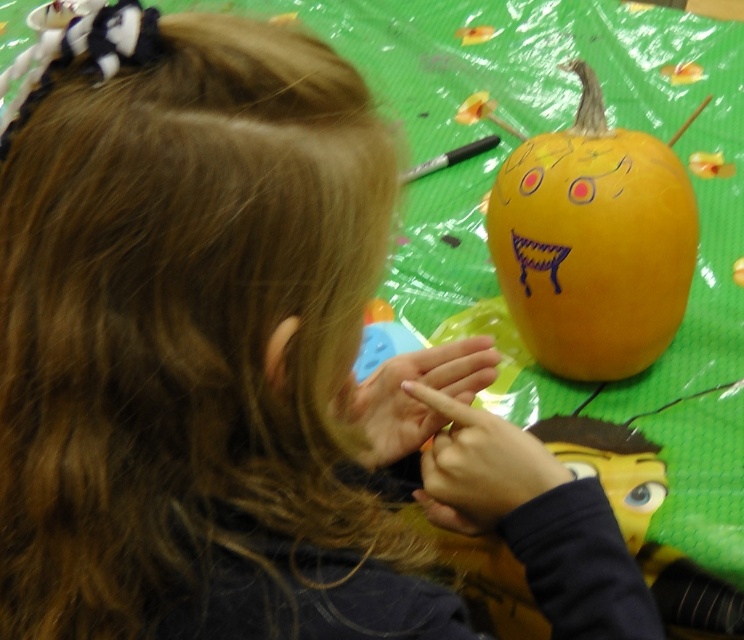
You are a parent helping your child decorate a pumpkin. You have a matte orange pumpkin at center and a smooth yellow face at center. Which object is bigger?

The matte orange pumpkin at center is larger in size than the smooth yellow face at center.

The matte orange pumpkin at center is placed on a green plastic tablecloth. If the pumpkin is 27.59 inches away from the edge of the tablecloth, can it fit entirely on the tablecloth if the tablecloth is 36 inches wide?

The matte orange pumpkin at center is 27.59 inches away from the edge of the tablecloth. Since the tablecloth is 36 inches wide, subtracting the distance from the edge gives 36 minus 27.59 equals 8.41 inches remaining. This remaining space is insufficient to fully accommodate the pumpkin, so it cannot fit entirely on the tablecloth.

What is the object located at the coordinate point (593, 243) in the image?

The object located at the coordinate point (593, 243) is the matte orange pumpkin at center.